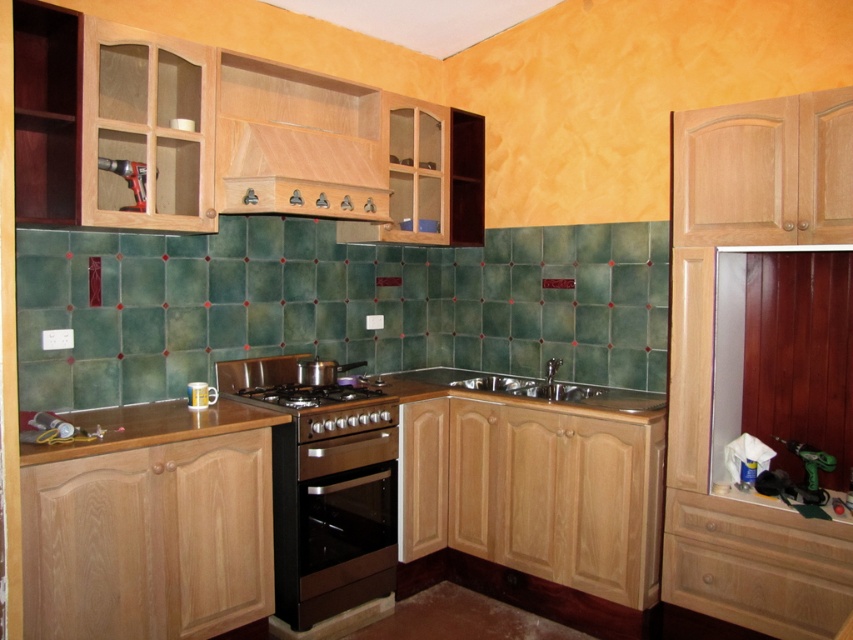
You are a chef preparing to move a large pot from the brown wood countertop at lower left to the black stainless steel gas stove at center. The pot is 12 inches wide. Can you slide the pot directly between them without lifting it?

The distance between the brown wood countertop at lower left and the black stainless steel gas stove at center is 13.08 inches. Since the pot is 12 inches wide, it can fit within the space, so you can slide the pot directly between them without lifting it.

You are standing in a kitchen that needs renovation. There is a point marked at coordinates point [311,394]. If you want to place a new appliance that requires 3 meters of space from where you are standing, will the point be within the required distance?

The point [311,394] is exactly 3.04 meters away from the viewer, which is slightly more than the required 3 meters. Therefore, the point is just outside the required distance for placing the appliance.